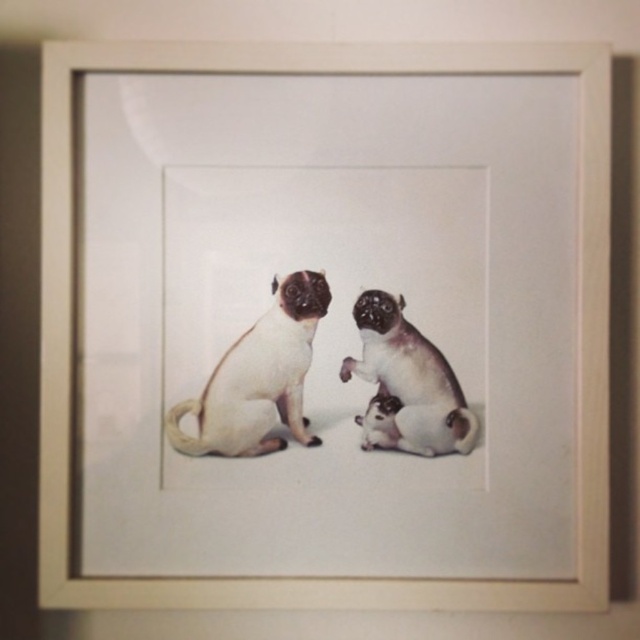
Question: Among these objects, which one is farthest from the camera?

Choices:
 (A) smooth white dog at lower right
 (B) smooth beige pug at center

Answer: (B)

Question: Is smooth beige pug at center further to the viewer compared to smooth white dog at lower right?

Choices:
 (A) no
 (B) yes

Answer: (B)

Question: Does smooth beige pug at center appear under smooth white dog at lower right?

Choices:
 (A) yes
 (B) no

Answer: (A)

Question: Does smooth beige pug at center lie behind smooth white dog at lower right?

Choices:
 (A) no
 (B) yes

Answer: (B)

Question: Which point is closer to the camera?

Choices:
 (A) smooth beige pug at center
 (B) smooth white dog at lower right

Answer: (B)